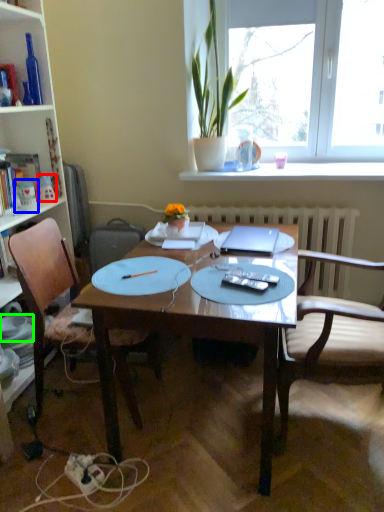
Question: Which is farther away from toy (highlighted by a red box)? toy (highlighted by a blue box) or tableware (highlighted by a green box)?

Choices:
 (A) toy
 (B) tableware

Answer: (B)